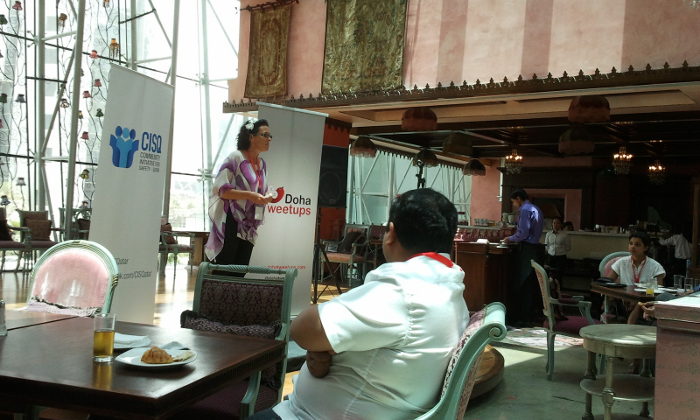
This screenshot has height=420, width=700. What are the coordinates of `chair` in the screenshot? It's located at (231, 298).